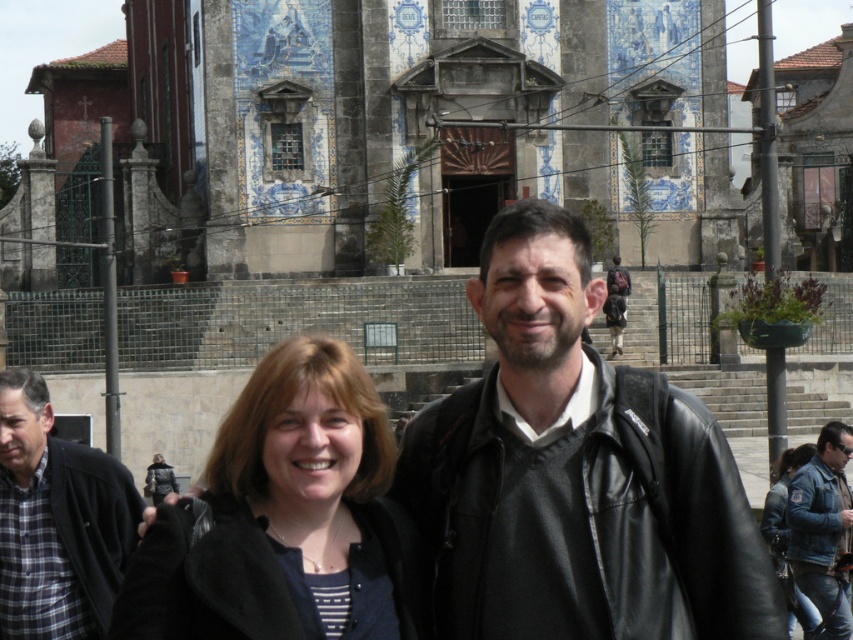
You are a photographer trying to capture a photo of the historic building with the two people in the foreground. You want to ensure both the black leather jacket at center and the plaid fabric shirt at left are clearly visible. Given their sizes, which clothing item might you need to position closer to the camera to maintain clarity in the photo?

The plaid fabric shirt at left is smaller in size compared to the black leather jacket at center, so positioning the plaid fabric shirt at left closer to the camera would help ensure its details are clearly visible alongside the larger jacket.

You are a photographer taking a picture of the historic building with two people in the frame. The blue denim jeans at lower right and denim jacket at lower right are both in the lower right corner. Which one is taller?

The blue denim jeans at lower right is taller than the denim jacket at lower right.

You are a photographer trying to capture a detailed shot of the historic building. You notice two items at the lower right corner of your frame that might obstruct the view. Can you determine which item takes up more space in the frame between the blue denim jeans at lower right and the denim jacket at lower right?

The denim jacket at lower right occupies more space in the frame than the blue denim jeans at lower right, so it is the larger obstruction.